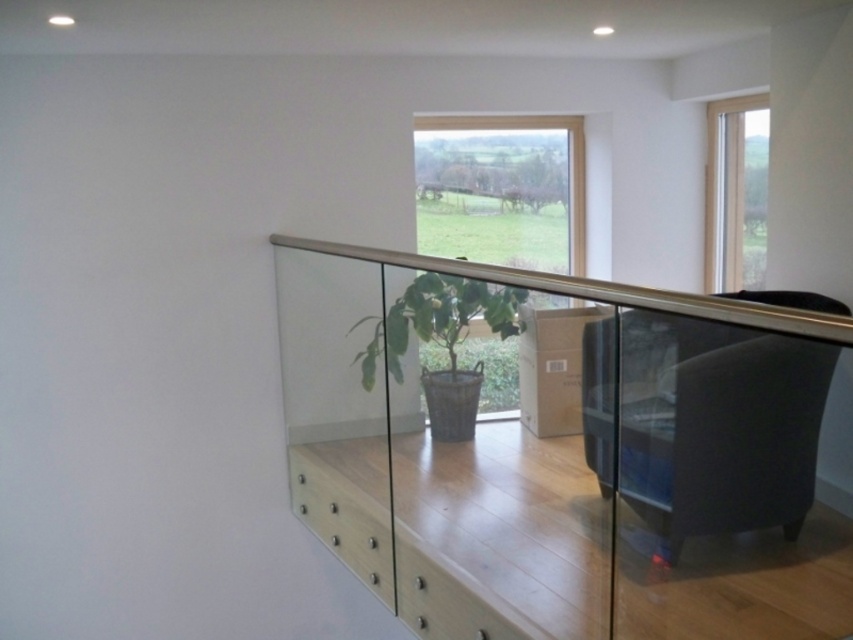
Who is positioned more to the right, transparent glass cabinet at center or green matte plant at center?

From the viewer's perspective, transparent glass cabinet at center appears more on the right side.

Is point (590, 280) positioned after point (403, 333)?

That is False.

Measure the distance between point [589,436] and camera.

Point [589,436] is 3.46 meters from camera.

Locate an element on the screen. transparent glass cabinet at center is located at coordinates (572, 452).

Which is more to the right, black leather chair at right or green matte plant at center?

black leather chair at right is more to the right.

Between black leather chair at right and green matte plant at center, which one has more height?

Standing taller between the two is green matte plant at center.

Find the location of `black leather chair at right`. black leather chair at right is located at coordinates (717, 426).

I want to click on black leather chair at right, so click(x=717, y=426).

Is point (756, 438) positioned in front of point (577, 131)?

Yes, it is.

Is point (747, 452) positioned behind point (570, 134)?

No, (747, 452) is in front of (570, 134).

Where is `black leather chair at right`? This screenshot has width=853, height=640. black leather chair at right is located at coordinates (717, 426).